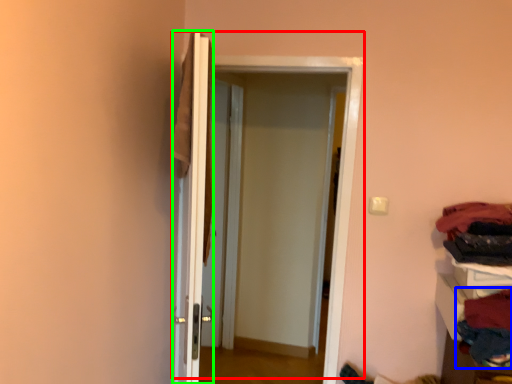
Question: Which object is the farthest from door (highlighted by a red box)? Choose among these: clothing (highlighted by a blue box) or door (highlighted by a green box).

Choices:
 (A) clothing
 (B) door

Answer: (A)